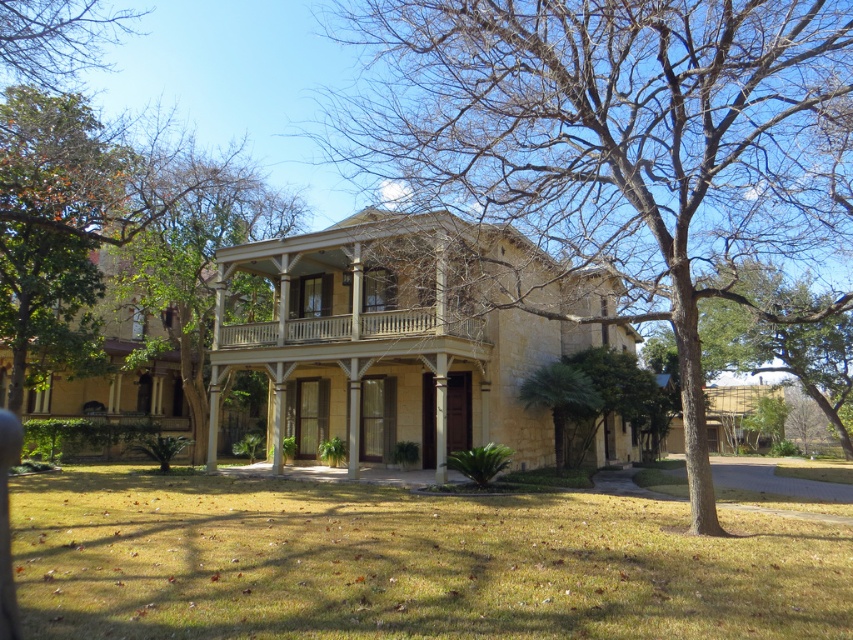
Is green leafy tree at center thinner than white wood porch at center?

Incorrect, green leafy tree at center's width is not less than white wood porch at center's.

Between point (726, 337) and point (364, 339), which one is positioned behind?

The point (726, 337) is behind.

Does point (708, 369) come farther from viewer compared to point (483, 330)?

That is True.

Find the location of a particular element. green leafy tree at center is located at coordinates (781, 337).

Does green leafy tree at center have a larger size compared to brown wood tree at upper left?

Yes, green leafy tree at center is bigger than brown wood tree at upper left.

This screenshot has height=640, width=853. Describe the element at coordinates (781, 337) in the screenshot. I see `green leafy tree at center` at that location.

What do you see at coordinates (781, 337) in the screenshot? The image size is (853, 640). I see `green leafy tree at center` at bounding box center [781, 337].

Locate an element on the screen. This screenshot has width=853, height=640. green leafy tree at center is located at coordinates (781, 337).

Is the position of brown wood tree at upper left less distant than that of white wood porch at center?

Yes.

Is point (59, 58) positioned behind point (386, 320)?

Yes, it is behind point (386, 320).

This screenshot has width=853, height=640. I want to click on brown wood tree at upper left, so click(x=56, y=38).